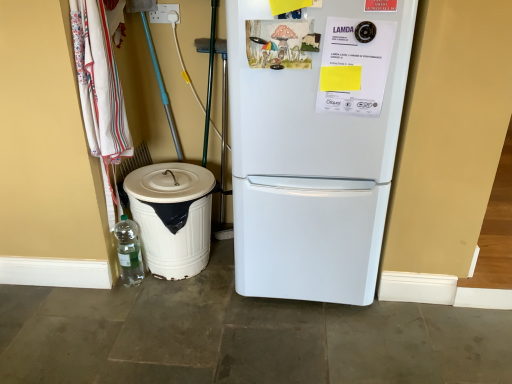
The image size is (512, 384). I want to click on clear plastic bottle at lower left, so click(x=129, y=251).

Measure the distance between white fabric laundry at left and camera.

white fabric laundry at left is 1.47 meters away from camera.

This screenshot has height=384, width=512. What do you see at coordinates (100, 91) in the screenshot?
I see `white fabric laundry at left` at bounding box center [100, 91].

Describe the element at coordinates (172, 216) in the screenshot. I see `white plastic trash can at lower left` at that location.

The height and width of the screenshot is (384, 512). Describe the element at coordinates (310, 168) in the screenshot. I see `white matte refrigerator at center` at that location.

I want to click on clear plastic bottle at lower left, so click(x=129, y=251).

From a real-world perspective, is clear plastic bottle at lower left physically above white matte refrigerator at center?

Incorrect, from a real-world perspective, clear plastic bottle at lower left is lower than white matte refrigerator at center.

How much distance is there between clear plastic bottle at lower left and white matte refrigerator at center?

A distance of 31.23 inches exists between clear plastic bottle at lower left and white matte refrigerator at center.

Is clear plastic bottle at lower left beside white matte refrigerator at center?

No.

Is clear plastic bottle at lower left positioned beyond the bounds of white matte refrigerator at center?

Yes.

Which is correct: white plastic electric outlet at upper center is inside white plastic trash can at lower left, or outside of it?

white plastic electric outlet at upper center lies outside white plastic trash can at lower left.

Would you consider white plastic electric outlet at upper center to be distant from white plastic trash can at lower left?

white plastic electric outlet at upper center is near white plastic trash can at lower left, not far away.

Which is in front, white plastic electric outlet at upper center or white plastic trash can at lower left?

white plastic trash can at lower left.

What's the angular difference between white plastic electric outlet at upper center and white plastic trash can at lower left's facing directions?

1.82 degrees.

From a real-world perspective, who is located lower, clear plastic bottle at lower left or white fabric laundry at left?

In real-world perspective, clear plastic bottle at lower left is lower.

Considering the relative positions of clear plastic bottle at lower left and white fabric laundry at left in the image provided, is clear plastic bottle at lower left to the right of white fabric laundry at left from the viewer's perspective?

Yes.

Does point (129, 267) lie behind point (122, 99)?

Yes, point (129, 267) is behind point (122, 99).

Measure the distance from clear plastic bottle at lower left to white fabric laundry at left.

They are 15.27 inches apart.

Is white matte refrigerator at center beside clear plastic bottle at lower left?

white matte refrigerator at center and clear plastic bottle at lower left are not in contact.

Between white matte refrigerator at center and clear plastic bottle at lower left, which one has more height?

Standing taller between the two is white matte refrigerator at center.

Consider the image. Is white matte refrigerator at center oriented away from clear plastic bottle at lower left?

No, white matte refrigerator at center is not facing the opposite direction of clear plastic bottle at lower left.

From a real-world perspective, does white matte refrigerator at center sit lower than clear plastic bottle at lower left?

No, from a real-world perspective, white matte refrigerator at center is not below clear plastic bottle at lower left.

From a real-world perspective, which is physically below, clear plastic bottle at lower left or white plastic electric outlet at upper center?

clear plastic bottle at lower left is physically lower.

From the image's perspective, which one is positioned higher, clear plastic bottle at lower left or white plastic electric outlet at upper center?

From the image's view, white plastic electric outlet at upper center is above.

Could you tell me if clear plastic bottle at lower left is turned towards white plastic electric outlet at upper center?

No, clear plastic bottle at lower left is not oriented towards white plastic electric outlet at upper center.

There is a clear plastic bottle at lower left. In order to click on electric outlet above it (from a real-world perspective) in this screenshot , I will do `click(165, 14)`.

Is white matte refrigerator at center with white plastic electric outlet at upper center?

No, white matte refrigerator at center is not beside white plastic electric outlet at upper center.

In the image, is white matte refrigerator at center on the left side or the right side of white plastic electric outlet at upper center?

From the image, it's evident that white matte refrigerator at center is to the right of white plastic electric outlet at upper center.

Considering the positions of objects white matte refrigerator at center and white plastic electric outlet at upper center in the image provided, who is behind, white matte refrigerator at center or white plastic electric outlet at upper center?

white plastic electric outlet at upper center is further away from the camera.

Find the location of a particular element. electric outlet above the white matte refrigerator at center (from a real-world perspective) is located at coordinates (165, 14).

Is white matte refrigerator at center to the right of white plastic trash can at lower left from the viewer's perspective?

Yes, white matte refrigerator at center is to the right of white plastic trash can at lower left.

Between white matte refrigerator at center and white plastic trash can at lower left, which one has larger width?

With larger width is white matte refrigerator at center.

In the scene shown: Is white matte refrigerator at center taller than white plastic trash can at lower left?

Yes.

You are a GUI agent. You are given a task and a screenshot of the screen. Output one action in this format:
    pyautogui.click(x=<x>, y=<y>)
    Task: Click on the refrigerator above the clear plastic bottle at lower left (from a real-world perspective)
    Image resolution: width=512 pixels, height=384 pixels.
    Given the screenshot: What is the action you would take?
    pyautogui.click(x=310, y=168)

You are a GUI agent. You are given a task and a screenshot of the screen. Output one action in this format:
    pyautogui.click(x=<x>, y=<y>)
    Task: Click on the trash bin/can that appears in front of the white plastic electric outlet at upper center
    The image size is (512, 384).
    Given the screenshot: What is the action you would take?
    pyautogui.click(x=172, y=216)

From the image, which object appears to be farther from clear plastic bottle at lower left, white plastic trash can at lower left or white plastic electric outlet at upper center?

white plastic electric outlet at upper center lies further to clear plastic bottle at lower left than the other object.

Estimate the real-world distances between objects in this image. Which object is further from clear plastic bottle at lower left, white fabric laundry at left or white matte refrigerator at center?

white matte refrigerator at center.

Looking at the image, which one is located further to clear plastic bottle at lower left, white fabric laundry at left or white plastic trash can at lower left?

white fabric laundry at left is positioned further to the anchor clear plastic bottle at lower left.

From the image, which object appears to be nearer to white matte refrigerator at center, white plastic electric outlet at upper center or white plastic trash can at lower left?

The object closer to white matte refrigerator at center is white plastic trash can at lower left.

Based on their spatial positions, is clear plastic bottle at lower left or white fabric laundry at left closer to white plastic trash can at lower left?

Based on the image, clear plastic bottle at lower left appears to be nearer to white plastic trash can at lower left.

When comparing their distances from white fabric laundry at left, does white plastic electric outlet at upper center or white matte refrigerator at center seem closer?

white plastic electric outlet at upper center is closer to white fabric laundry at left.

Considering their positions, is white matte refrigerator at center positioned further to white fabric laundry at left than white plastic electric outlet at upper center?

The object further to white fabric laundry at left is white matte refrigerator at center.

From the image, which object appears to be nearer to white plastic electric outlet at upper center, white fabric laundry at left or white matte refrigerator at center?

The object closer to white plastic electric outlet at upper center is white fabric laundry at left.

Locate an element on the screen. The image size is (512, 384). trash bin/can between clear plastic bottle at lower left and white matte refrigerator at center from left to right is located at coordinates (172, 216).

What are the coordinates of `electric outlet situated between white fabric laundry at left and white matte refrigerator at center from left to right` in the screenshot? It's located at (165, 14).

Where is `trash bin/can that lies between white fabric laundry at left and clear plastic bottle at lower left from top to bottom`? The height and width of the screenshot is (384, 512). trash bin/can that lies between white fabric laundry at left and clear plastic bottle at lower left from top to bottom is located at coordinates (172, 216).

Find the location of `laundry between white plastic electric outlet at upper center and white plastic trash can at lower left in the up-down direction`. laundry between white plastic electric outlet at upper center and white plastic trash can at lower left in the up-down direction is located at coordinates (100, 91).